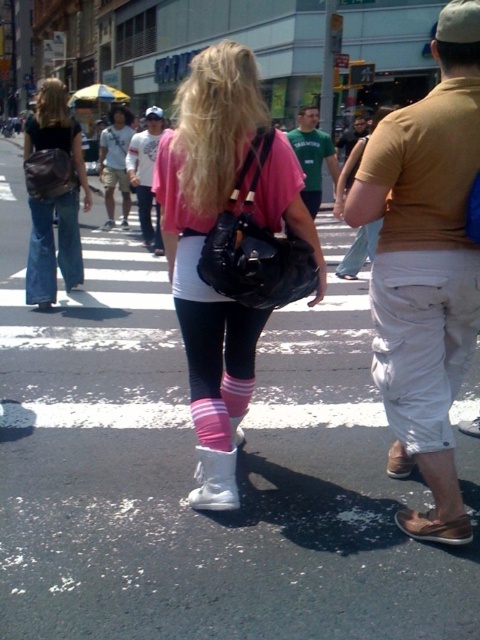
You are standing at the camera position and want to throw a ball to a friend who is at point (240, 419). There is an obstacle at point (314, 134). Will the ball pass over the obstacle?

Point (314, 134) is further to the camera than point (240, 419), so the ball will pass over the obstacle at point (314, 134) because it is closer to you.